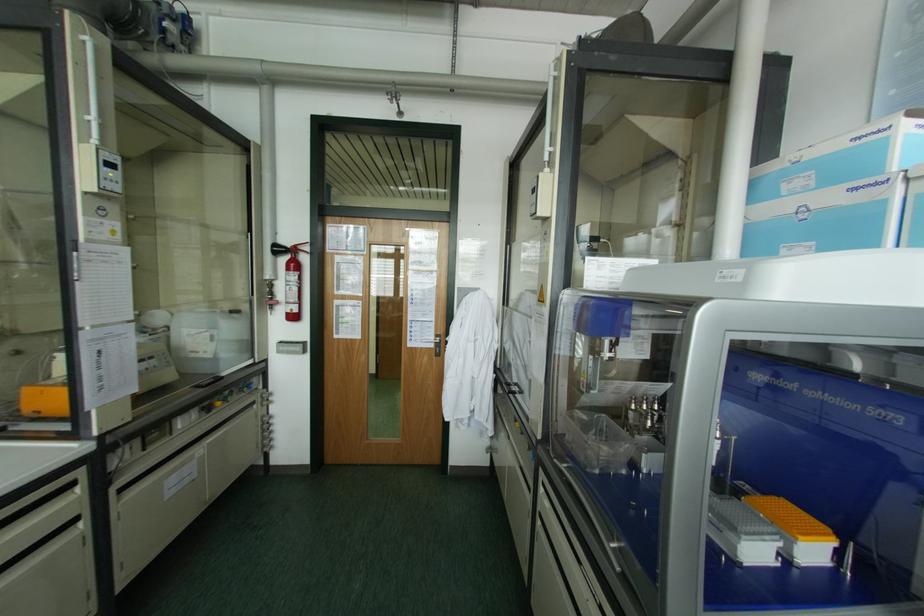
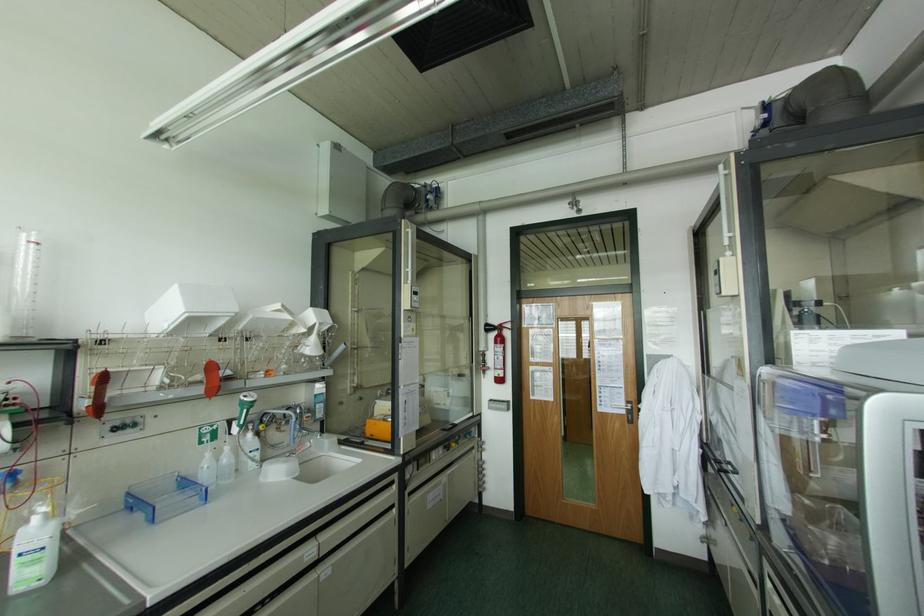
The point at (79, 488) is marked in the first image. Where is the corresponding point in the second image?

(394, 485)